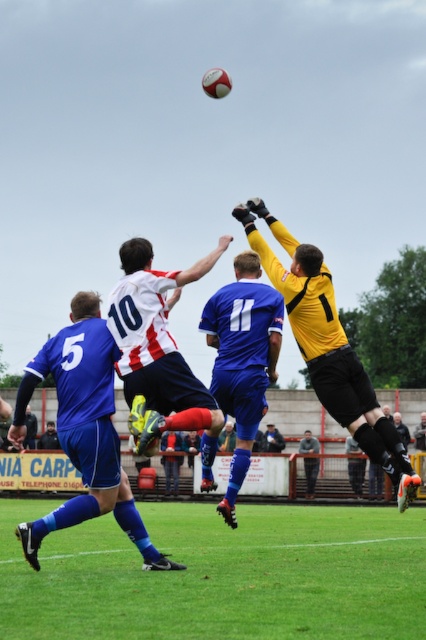
You are a soccer referee observing the match. You notice two players, the white striped jersey at center and the blue jersey at center, are both reaching for the soccer ball. Which player is closer to the ball?

The white striped jersey at center is positioned on the left side of the blue jersey at center. Since the ball is above the goalkeeper, it is likely closer to the blue jersey at center, which is positioned closer to the ball.

You are a soccer coach analyzing the game. You notice the green grass at lower center and the yellow jersey at center. Which object is closer to the ground?

The green grass at lower center is closer to the ground because it is shorter than the yellow jersey at center.

You are a soccer coach analyzing a match. You notice the blue fabric shorts at center and the yellow jersey at center. Which of these two items appears to be the smaller one in the image?

The blue fabric shorts at center is smaller than the yellow jersey at center.